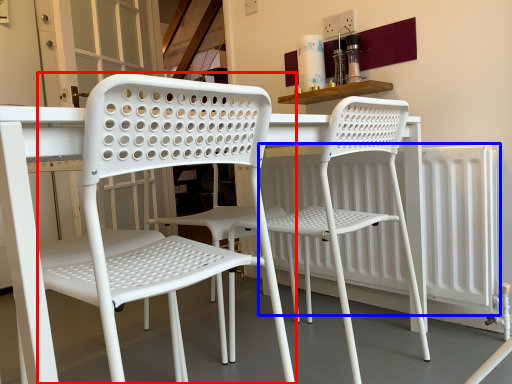
Question: Which of the following is the farthest to the observer, chair (highlighted by a red box) or radiator (highlighted by a blue box)?

Choices:
 (A) chair
 (B) radiator

Answer: (B)